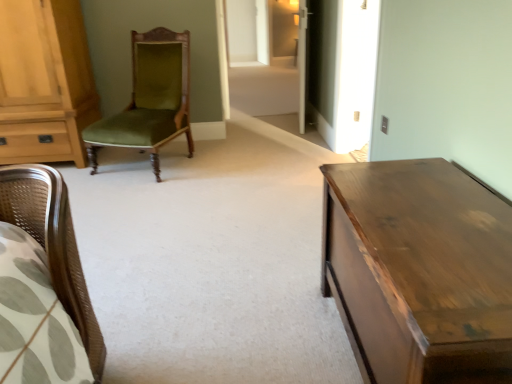
The width and height of the screenshot is (512, 384). What are the coordinates of `shiny brown wooden table at right` in the screenshot? It's located at (419, 271).

The image size is (512, 384). Describe the element at coordinates (44, 82) in the screenshot. I see `light brown wood cabinet at left` at that location.

I want to click on green velvet chair at center, so click(150, 99).

Is point (303, 63) positioned behind point (112, 142)?

Yes, point (303, 63) is farther from viewer.

Is transparent glass door at center at the right side of green velvet chair at center?

Yes, transparent glass door at center is to the right of green velvet chair at center.

Choose the correct answer: Is transparent glass door at center inside green velvet chair at center or outside it?

transparent glass door at center is not enclosed by green velvet chair at center.

Is transparent glass door at center facing towards green velvet chair at center?

No, transparent glass door at center is not oriented towards green velvet chair at center.

You are a GUI agent. You are given a task and a screenshot of the screen. Output one action in this format:
    pyautogui.click(x=<x>, y=<y>)
    Task: Click on the chair on the right of light brown wood cabinet at left
    
    Given the screenshot: What is the action you would take?
    pyautogui.click(x=150, y=99)

How distant is green velvet chair at center from light brown wood cabinet at left?

The distance of green velvet chair at center from light brown wood cabinet at left is 21.22 inches.

From the image's perspective, which is below, green velvet chair at center or light brown wood cabinet at left?

green velvet chair at center.

From a real-world perspective, between green velvet chair at center and light brown wood cabinet at left, who is vertically higher?

In real-world perspective, light brown wood cabinet at left is above.

Could you tell me if transparent glass door at center is turned towards shiny brown wooden table at right?

Yes.

Between transparent glass door at center and shiny brown wooden table at right, which one has smaller width?

With smaller width is transparent glass door at center.

Is transparent glass door at center not close to shiny brown wooden table at right?

Absolutely, transparent glass door at center is distant from shiny brown wooden table at right.

Is point (253, 107) behind point (482, 269)?

That is True.

Could you tell me if green velvet chair at center is turned towards transparent glass door at center?

No, green velvet chair at center is not aimed at transparent glass door at center.

Considering the relative positions of green velvet chair at center and transparent glass door at center in the image provided, is green velvet chair at center in front of transparent glass door at center?

Yes, green velvet chair at center is closer to the viewer.

Consider the image. Considering the relative sizes of green velvet chair at center and transparent glass door at center in the image provided, is green velvet chair at center taller than transparent glass door at center?

No, green velvet chair at center is not taller than transparent glass door at center.

Is green velvet chair at center far away from transparent glass door at center?

That's right, there is a large distance between green velvet chair at center and transparent glass door at center.

From the image's perspective, is shiny brown wooden table at right above green velvet chair at center?

Incorrect, from the image's perspective, shiny brown wooden table at right is lower than green velvet chair at center.

Considering the positions of point (450, 202) and point (169, 67), is point (450, 202) closer or farther from the camera than point (169, 67)?

Point (450, 202).

Can you confirm if light brown wood cabinet at left is thinner than shiny brown wooden table at right?

No, light brown wood cabinet at left is not thinner than shiny brown wooden table at right.

Which of these two, light brown wood cabinet at left or shiny brown wooden table at right, stands shorter?

shiny brown wooden table at right.

Is light brown wood cabinet at left positioned with its back to shiny brown wooden table at right?

No, light brown wood cabinet at left is not facing away from shiny brown wooden table at right.

Is light brown wood cabinet at left bigger or smaller than green velvet chair at center?

Clearly, light brown wood cabinet at left is larger in size than green velvet chair at center.

Which of these two, light brown wood cabinet at left or green velvet chair at center, is thinner?

light brown wood cabinet at left.

Is light brown wood cabinet at left to the right of green velvet chair at center from the viewer's perspective?

Result: No, light brown wood cabinet at left is not to the right of green velvet chair at center.

From a real-world perspective, is light brown wood cabinet at left positioned under green velvet chair at center based on gravity?

No, from a real-world perspective, light brown wood cabinet at left is not below green velvet chair at center.

At what (x,y) coordinates should I click in order to perform the action: click on glass door located above the green velvet chair at center (from the image's perspective). Please return your answer as a coordinate pair (x, y). The height and width of the screenshot is (384, 512). Looking at the image, I should click on (266, 56).

What are the coordinates of `chair lying in front of the light brown wood cabinet at left` in the screenshot? It's located at (150, 99).

Which object lies further to the anchor point transparent glass door at center, green velvet chair at center or shiny brown wooden table at right?

shiny brown wooden table at right lies further to transparent glass door at center than the other object.

When comparing their distances from shiny brown wooden table at right, does transparent glass door at center or green velvet chair at center seem further?

transparent glass door at center is positioned further to the anchor shiny brown wooden table at right.

Based on the photo, which object lies nearer to the anchor point green velvet chair at center, light brown wood cabinet at left or shiny brown wooden table at right?

light brown wood cabinet at left lies closer to green velvet chair at center than the other object.

Looking at the image, which one is located closer to transparent glass door at center, green velvet chair at center or light brown wood cabinet at left?

Based on the image, green velvet chair at center appears to be nearer to transparent glass door at center.

When comparing their distances from transparent glass door at center, does light brown wood cabinet at left or green velvet chair at center seem further?

The object further to transparent glass door at center is light brown wood cabinet at left.

Based on their spatial positions, is green velvet chair at center or transparent glass door at center further from shiny brown wooden table at right?

transparent glass door at center is further to shiny brown wooden table at right.

When comparing their distances from shiny brown wooden table at right, does light brown wood cabinet at left or transparent glass door at center seem closer?

Among the two, light brown wood cabinet at left is located nearer to shiny brown wooden table at right.

From the image, which object appears to be nearer to light brown wood cabinet at left, green velvet chair at center or transparent glass door at center?

Based on the image, green velvet chair at center appears to be nearer to light brown wood cabinet at left.

Where is `cabinetry between shiny brown wooden table at right and transparent glass door at center from front to back`? Image resolution: width=512 pixels, height=384 pixels. cabinetry between shiny brown wooden table at right and transparent glass door at center from front to back is located at coordinates (44, 82).

The image size is (512, 384). In order to click on chair situated between light brown wood cabinet at left and shiny brown wooden table at right from left to right in this screenshot , I will do `click(150, 99)`.

Identify the location of chair between light brown wood cabinet at left and transparent glass door at center from left to right. The width and height of the screenshot is (512, 384). (150, 99).

The image size is (512, 384). Find the location of `chair positioned between shiny brown wooden table at right and transparent glass door at center from near to far`. chair positioned between shiny brown wooden table at right and transparent glass door at center from near to far is located at coordinates (150, 99).